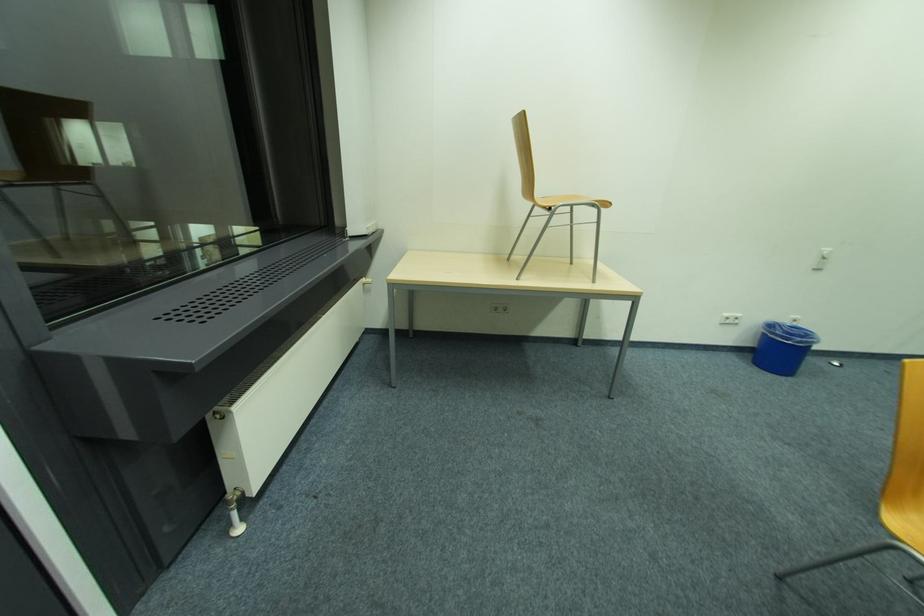
What are the coordinates of `blue trash can` in the screenshot? It's located at point(783,347).